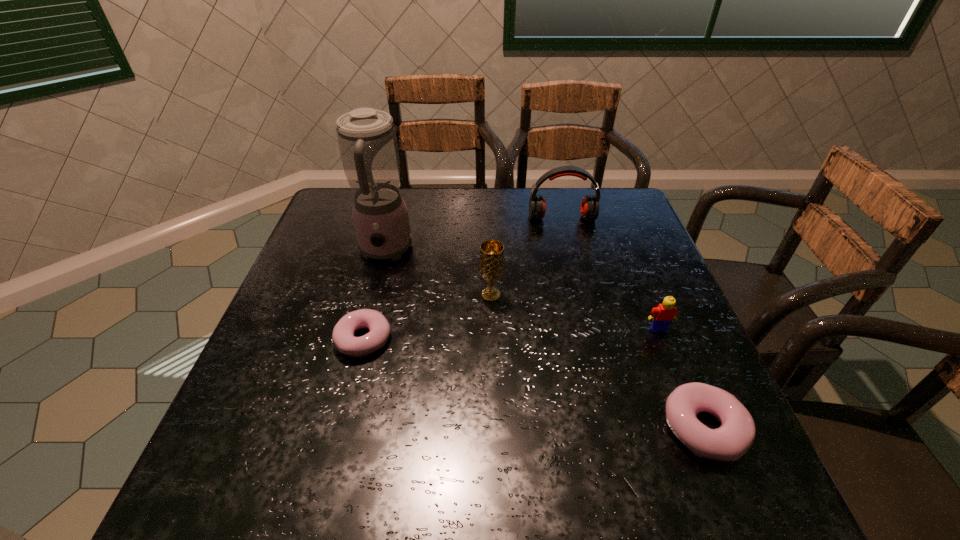
Where is `vacant area that lies between the chalice and the third shortest object`? This screenshot has width=960, height=540. vacant area that lies between the chalice and the third shortest object is located at coordinates (575, 312).

Identify the location of free space between the second farthest object and the nearest object. (544, 340).

Where is `free space between the left doughnut and the nearest object`? free space between the left doughnut and the nearest object is located at coordinates (534, 384).

Locate which object ranks fourth in proximity to the Lego. Please provide its 2D coordinates. Your answer should be formatted as a tuple, i.e. [(x, y)], where the tuple contains the x and y coordinates of a point satisfying the conditions above.

[(343, 339)]

Locate which object is the fifth closest to the Lego. Please provide its 2D coordinates. Your answer should be formatted as a tuple, i.e. [(x, y)], where the tuple contains the x and y coordinates of a point satisfying the conditions above.

[(367, 141)]

I want to click on free spot that satisfies the following two spatial constraints: 1. on the ear cups of the taller doughnut; 2. on the left side of the farthest object, so click(x=612, y=429).

In order to click on vacant space that satisfies the following two spatial constraints: 1. on the base of the fourth object from right to left near the control knob; 2. on the left side of the fifth nearest object in this screenshot , I will do `click(373, 295)`.

Find the location of a particular element. vacant space that satisfies the following two spatial constraints: 1. on the base of the nearest object near the control knob; 2. on the right side of the food processor is located at coordinates (340, 429).

Where is `vacant point that satisfies the following two spatial constraints: 1. on the base of the third object from left to right near the control knob; 2. on the left side of the tallest object`? Image resolution: width=960 pixels, height=540 pixels. vacant point that satisfies the following two spatial constraints: 1. on the base of the third object from left to right near the control knob; 2. on the left side of the tallest object is located at coordinates click(x=373, y=295).

Find the location of a particular element. The height and width of the screenshot is (540, 960). free location that satisfies the following two spatial constraints: 1. on the base of the fifth nearest object near the control knob; 2. on the left side of the shorter doughnut is located at coordinates (363, 339).